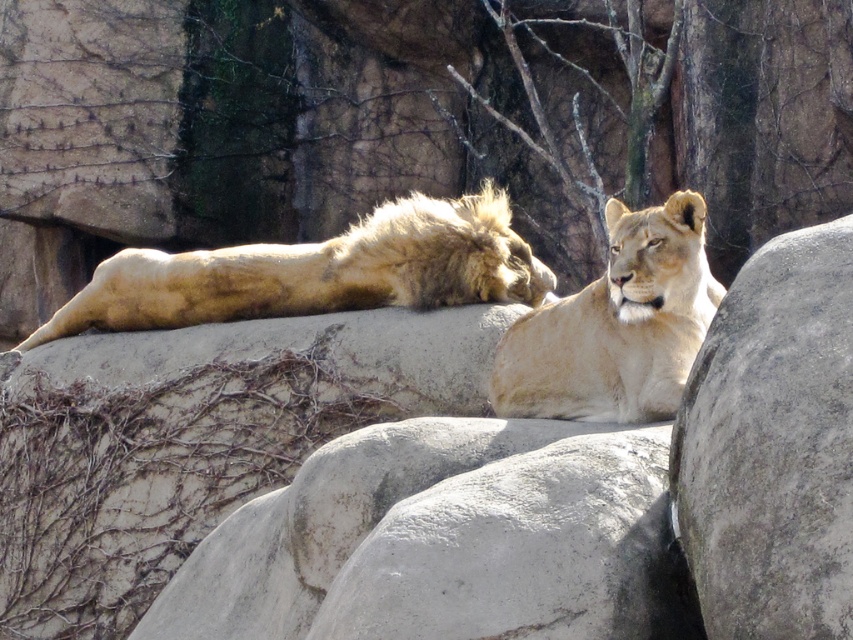
Between gray rough boulder at right and golden fur lion at center, which one appears on the right side from the viewer's perspective?

Positioned to the right is gray rough boulder at right.

Based on the photo, can you confirm if gray rough boulder at right is positioned to the right of golden fur lion at center?

Indeed, gray rough boulder at right is positioned on the right side of golden fur lion at center.

This screenshot has height=640, width=853. What do you see at coordinates (772, 445) in the screenshot? I see `gray rough boulder at right` at bounding box center [772, 445].

Where is `gray rough boulder at right`? The width and height of the screenshot is (853, 640). gray rough boulder at right is located at coordinates (772, 445).

Who is higher up, gray rough boulder at right or light brown fur lioness at center?

Positioned higher is light brown fur lioness at center.

Is gray rough boulder at right positioned behind light brown fur lioness at center?

No, gray rough boulder at right is closer to the viewer.

The width and height of the screenshot is (853, 640). Identify the location of gray rough boulder at right. (772, 445).

Who is taller, gray rough boulder at center or light brown fur lioness at center?

Result: With more height is light brown fur lioness at center.

Consider the image. Does gray rough boulder at center appear over light brown fur lioness at center?

Actually, gray rough boulder at center is below light brown fur lioness at center.

Between point (526, 593) and point (561, 417), which one is positioned behind?

Positioned behind is point (561, 417).

I want to click on gray rough boulder at center, so click(x=524, y=545).